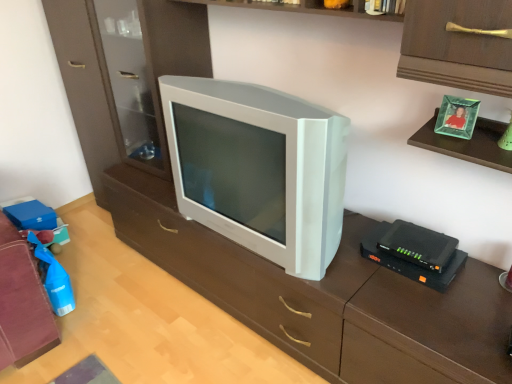
Describe the element at coordinates (326, 297) in the screenshot. I see `white plastic tv at center` at that location.

Locate an element on the screen. This screenshot has width=512, height=384. white plastic tv at center is located at coordinates (326, 297).

At what (x,y) coordinates should I click in order to perform the action: click on white plastic television at center. Please return your answer as a coordinate pair (x, y). This screenshot has width=512, height=384. Looking at the image, I should click on coord(258,168).

At what (x,y) coordinates should I click in order to perform the action: click on black plastic router at right. Please return your answer as a coordinate pair (x, y). This screenshot has width=512, height=384. Looking at the image, I should click on (418, 245).

Does white plastic tv at center have a lesser width compared to black plastic router at right?

Incorrect, the width of white plastic tv at center is not less than that of black plastic router at right.

Is white plastic tv at center in front of or behind black plastic router at right in the image?

In the image, white plastic tv at center appears in front of black plastic router at right.

What's the angular difference between white plastic tv at center and black plastic router at right's facing directions?

The angle between the facing direction of white plastic tv at center and the facing direction of black plastic router at right is 93.8 degrees.

Does white plastic tv at center have a lesser height compared to black plastic router at right?

In fact, white plastic tv at center may be taller than black plastic router at right.

Based on the photo, in terms of width, does white plastic tv at center look wider or thinner when compared to white plastic television at center?

Clearly, white plastic tv at center has more width compared to white plastic television at center.

Considering the positions of point (155, 219) and point (202, 129), is point (155, 219) closer or farther from the camera than point (202, 129)?

Clearly, point (155, 219) is more distant from the camera than point (202, 129).

Find the location of a particular element. The width and height of the screenshot is (512, 384). computer desk that appears in front of the white plastic television at center is located at coordinates (326, 297).

From a real-world perspective, is white plastic tv at center physically located above or below white plastic television at center?

In terms of real-world spatial position, white plastic tv at center is below white plastic television at center.

Which object is more forward, white plastic television at center or black plastic router at right?

white plastic television at center is closer to the camera.

From a real-world perspective, is white plastic television at center physically located above or below black plastic router at right?

white plastic television at center is situated higher than black plastic router at right in the real world.

Is point (186, 94) in front of point (426, 255)?

No, it is not.

Is white plastic television at center next to black plastic router at right and touching it?

No, white plastic television at center is not touching black plastic router at right.

Which object is positioned more to the right, black plastic router at right or white plastic television at center?

black plastic router at right is more to the right.

Which point is more distant from viewer, (387, 237) or (297, 204)?

The point (387, 237) is behind.

From their relative heights in the image, would you say black plastic router at right is taller or shorter than white plastic television at center?

Clearly, black plastic router at right is shorter compared to white plastic television at center.

Is black plastic router at right in contact with white plastic television at center?

They are not placed beside each other.

Considering the sizes of objects white plastic television at center and white plastic tv at center in the image provided, who is wider, white plastic television at center or white plastic tv at center?

white plastic tv at center.

Locate an element on the screen. television located behind the white plastic tv at center is located at coordinates (258, 168).

Considering the positions of points (182, 177) and (400, 356), is point (182, 177) closer to camera compared to point (400, 356)?

No.

Which object is closer to the camera, black plastic router at right or white plastic tv at center?

white plastic tv at center.

From the image's perspective, is black plastic router at right positioned above or below white plastic tv at center?

Clearly, from the image's perspective, black plastic router at right is above white plastic tv at center.

Do you think black plastic router at right is within white plastic tv at center, or outside of it?

black plastic router at right exists outside the volume of white plastic tv at center.

From a real-world perspective, who is located lower, black plastic router at right or white plastic tv at center?

white plastic tv at center is physically lower.

At what (x,y) coordinates should I click in order to perform the action: click on computer desk that appears below the black plastic router at right (from a real-world perspective). Please return your answer as a coordinate pair (x, y). The height and width of the screenshot is (384, 512). Looking at the image, I should click on (326, 297).

Where is `computer desk below the white plastic television at center (from the image's perspective)`? The image size is (512, 384). computer desk below the white plastic television at center (from the image's perspective) is located at coordinates (326, 297).

In the scene shown: When comparing their distances from black plastic router at right, does white plastic television at center or white plastic tv at center seem further?

Based on the image, white plastic television at center appears to be further to black plastic router at right.

Estimate the real-world distances between objects in this image. Which object is further from black plastic router at right, white plastic tv at center or white plastic television at center?

Based on the image, white plastic television at center appears to be further to black plastic router at right.

Considering their positions, is black plastic router at right positioned closer to white plastic television at center than white plastic tv at center?

Based on the image, white plastic tv at center appears to be nearer to white plastic television at center.

Looking at this image, which object lies further to the anchor point white plastic tv at center, white plastic television at center or black plastic router at right?

black plastic router at right is further to white plastic tv at center.

Which object lies nearer to the anchor point white plastic television at center, white plastic tv at center or black plastic router at right?

white plastic tv at center.

In the scene shown: When comparing their distances from white plastic tv at center, does black plastic router at right or white plastic television at center seem closer?

white plastic television at center is closer to white plastic tv at center.

The height and width of the screenshot is (384, 512). I want to click on television between white plastic tv at center and black plastic router at right from left to right, so click(258, 168).